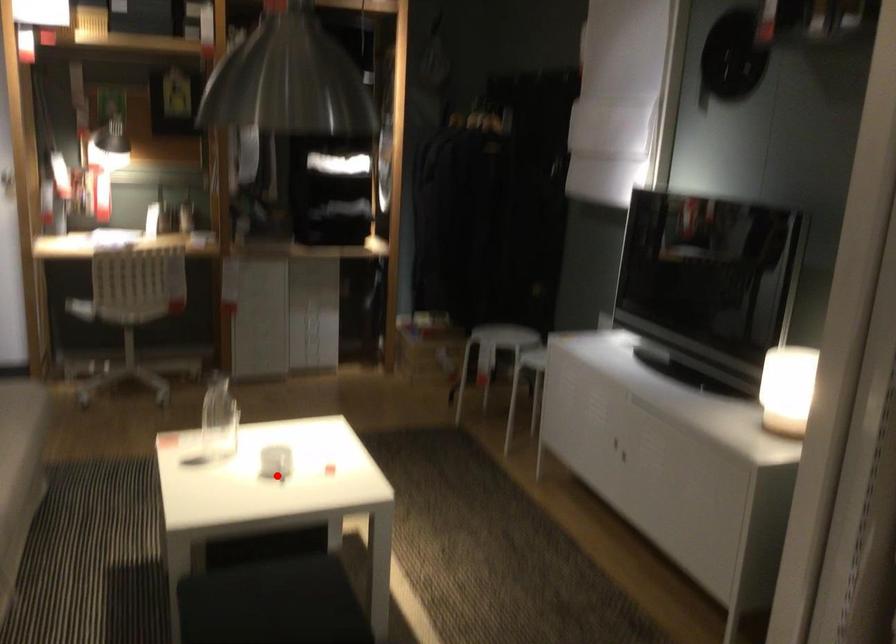
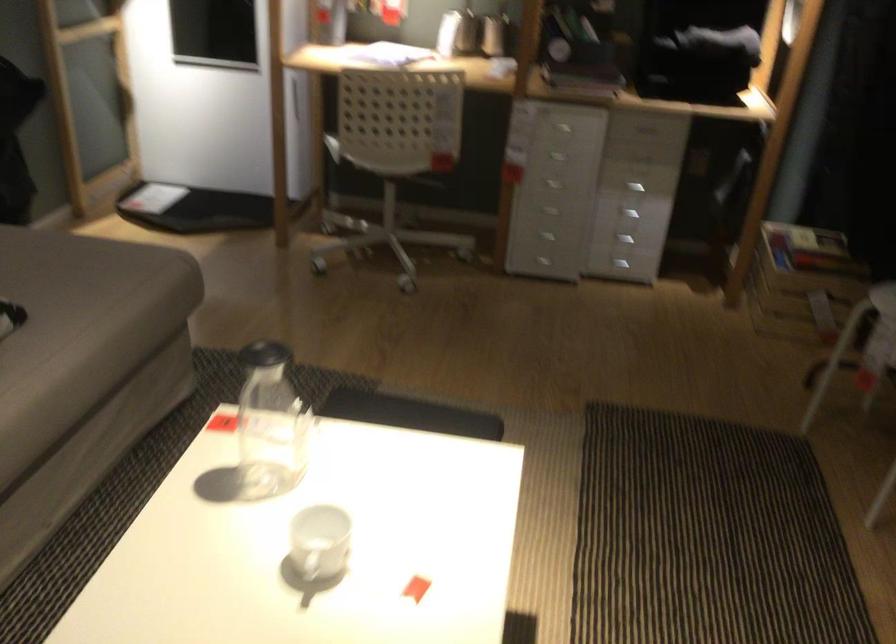
In the second image, find the point that corresponds to the highlighted location in the first image.

(320, 542)